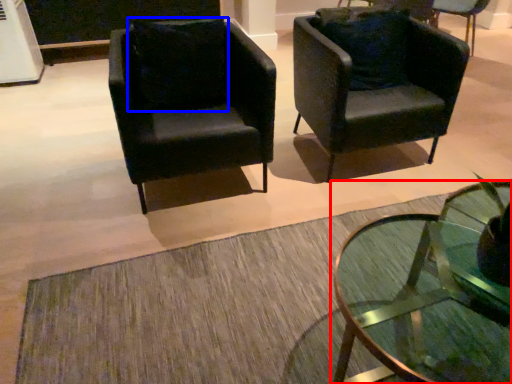
Question: Among these objects, which one is nearest to the camera, coffee table (highlighted by a red box) or pillow (highlighted by a blue box)?

Choices:
 (A) coffee table
 (B) pillow

Answer: (A)